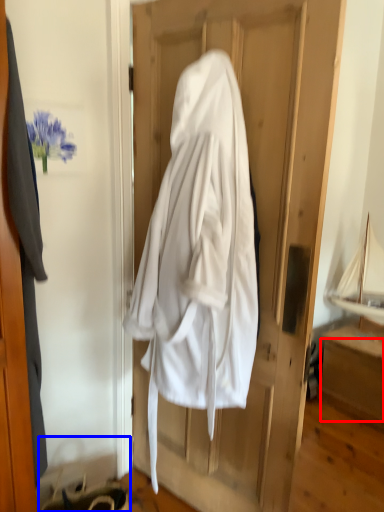
Question: Among these objects, which one is nearest to the camera, drawer (highlighted by a red box) or hanger (highlighted by a blue box)?

Choices:
 (A) drawer
 (B) hanger

Answer: (B)